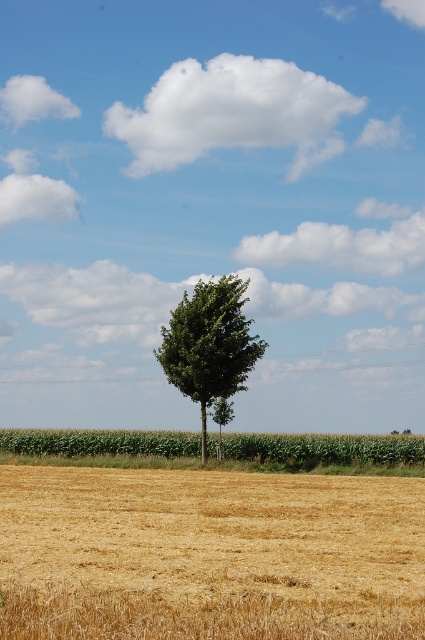
Question: Which point is closer to the camera?

Choices:
 (A) (320, 630)
 (B) (401, 465)
 (C) (175, 369)

Answer: (A)

Question: In this image, where is green matte corn field at center located relative to green leafy tree at center?

Choices:
 (A) above
 (B) below

Answer: (B)

Question: Which of the following is the farthest from the observer?

Choices:
 (A) green matte corn field at center
 (B) green leafy tree at center

Answer: (A)

Question: Can you confirm if green matte corn field at center is positioned to the right of green leafy tree at center?

Choices:
 (A) no
 (B) yes

Answer: (B)

Question: Does golden dry wheat at center have a smaller size compared to green matte corn field at center?

Choices:
 (A) no
 (B) yes

Answer: (B)

Question: Which point is closer to the camera?

Choices:
 (A) (146, 566)
 (B) (19, 461)
 (C) (201, 339)

Answer: (A)